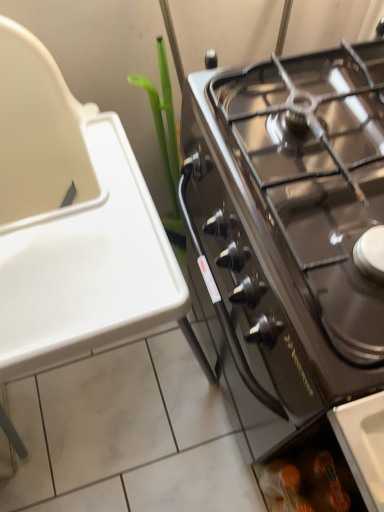
Question: Is black glass gas stove at right behind green plastic plant at upper left?

Choices:
 (A) yes
 (B) no

Answer: (B)

Question: From a real-world perspective, is black glass gas stove at right located higher than green plastic plant at upper left?

Choices:
 (A) yes
 (B) no

Answer: (A)

Question: Would you say green plastic plant at upper left is part of black glass gas stove at right's contents?

Choices:
 (A) yes
 (B) no

Answer: (B)

Question: Is black glass gas stove at right smaller than green plastic plant at upper left?

Choices:
 (A) yes
 (B) no

Answer: (B)

Question: Does black glass gas stove at right have a lesser width compared to green plastic plant at upper left?

Choices:
 (A) yes
 (B) no

Answer: (B)

Question: Considering their positions, is translucent plastic bag at lower right located in front of or behind black glass gas stove at right?

Choices:
 (A) behind
 (B) front

Answer: (A)

Question: Is point (276, 501) closer or farther from the camera than point (322, 67)?

Choices:
 (A) farther
 (B) closer

Answer: (A)

Question: From their relative heights in the image, would you say translucent plastic bag at lower right is taller or shorter than black glass gas stove at right?

Choices:
 (A) tall
 (B) short

Answer: (A)

Question: Visually, is translucent plastic bag at lower right positioned to the left or to the right of black glass gas stove at right?

Choices:
 (A) left
 (B) right

Answer: (B)

Question: Considering the positions of black glass gas stove at right and green plastic plant at upper left in the image, is black glass gas stove at right bigger or smaller than green plastic plant at upper left?

Choices:
 (A) small
 (B) big

Answer: (B)

Question: Considering the positions of point (299, 389) and point (145, 86), is point (299, 389) closer or farther from the camera than point (145, 86)?

Choices:
 (A) closer
 (B) farther

Answer: (A)

Question: From a real-world perspective, is black glass gas stove at right physically located above or below green plastic plant at upper left?

Choices:
 (A) below
 (B) above

Answer: (B)

Question: Considering their positions, is black glass gas stove at right located in front of or behind green plastic plant at upper left?

Choices:
 (A) behind
 (B) front

Answer: (B)

Question: Considering the positions of translucent plastic bag at lower right and green plastic plant at upper left in the image, is translucent plastic bag at lower right bigger or smaller than green plastic plant at upper left?

Choices:
 (A) big
 (B) small

Answer: (B)

Question: In the image, is translucent plastic bag at lower right on the left side or the right side of green plastic plant at upper left?

Choices:
 (A) left
 (B) right

Answer: (B)